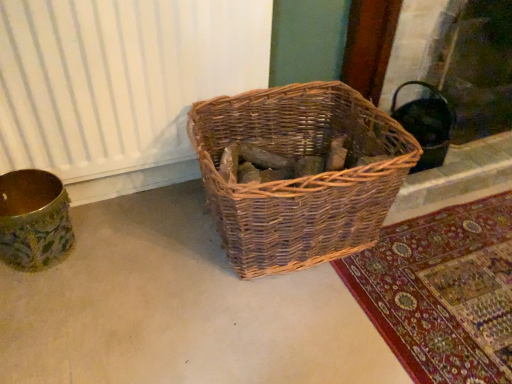
I want to click on free space between natural woven basket at center and gold textured vase at left, so 136,253.